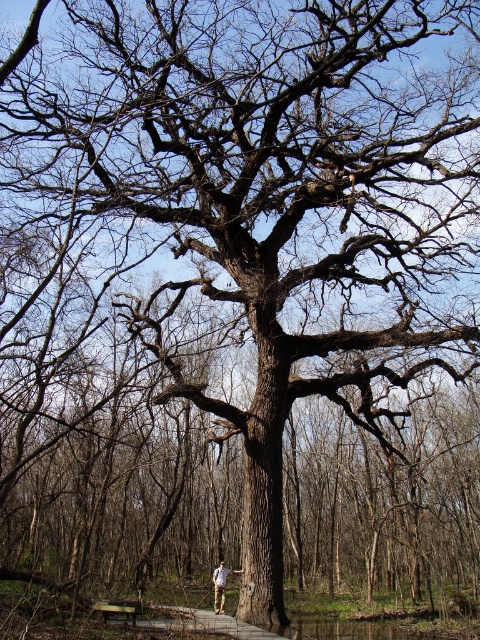
Can you confirm if wooden bench at lower center is positioned to the right of khaki pants at center?

Incorrect, wooden bench at lower center is not on the right side of khaki pants at center.

Identify the location of wooden bench at lower center. The height and width of the screenshot is (640, 480). (118, 609).

Where is `wooden bench at lower center`? wooden bench at lower center is located at coordinates (118, 609).

The width and height of the screenshot is (480, 640). I want to click on wooden bench at lower center, so click(x=118, y=609).